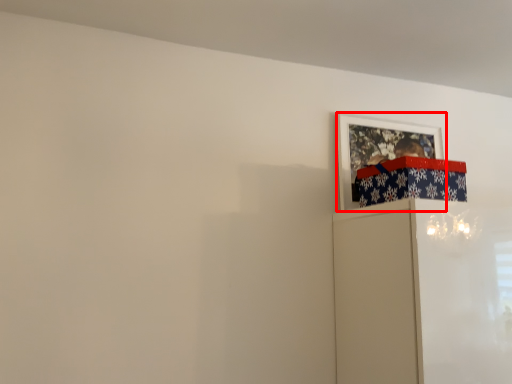
Question: Considering the relative positions of picture frame (annotated by the red box) and wrapping paper in the image provided, where is picture frame (annotated by the red box) located with respect to the staircase?

Choices:
 (A) left
 (B) right

Answer: (B)